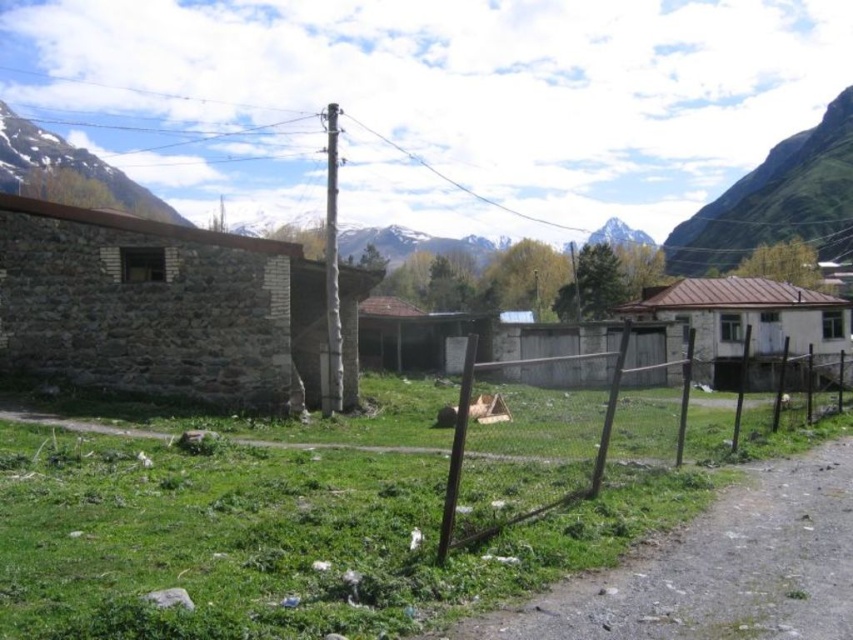
Question: Estimate the real-world distances between objects in this image. Which object is closer to the white painted wood house at right?

Choices:
 (A) gravelly dirt path at center
 (B) metallic wire fence at center
 (C) stone wall at left
 (D) green grass at lower center

Answer: (B)

Question: Is green grass at lower center to the right of white painted wood house at right from the viewer's perspective?

Choices:
 (A) no
 (B) yes

Answer: (A)

Question: Among these objects, which one is farthest from the camera?

Choices:
 (A) white painted wood house at right
 (B) gravelly dirt path at center
 (C) stone wall at left

Answer: (A)

Question: Is metallic wire fence at center behind snowy rock mountain at upper left?

Choices:
 (A) yes
 (B) no

Answer: (B)

Question: Which point is farther to the camera?

Choices:
 (A) stone wall at left
 (B) white painted wood house at right
 (C) green grass at lower center

Answer: (B)

Question: Is gravelly dirt path at center positioned in front of snowy rock mountain at upper left?

Choices:
 (A) yes
 (B) no

Answer: (A)